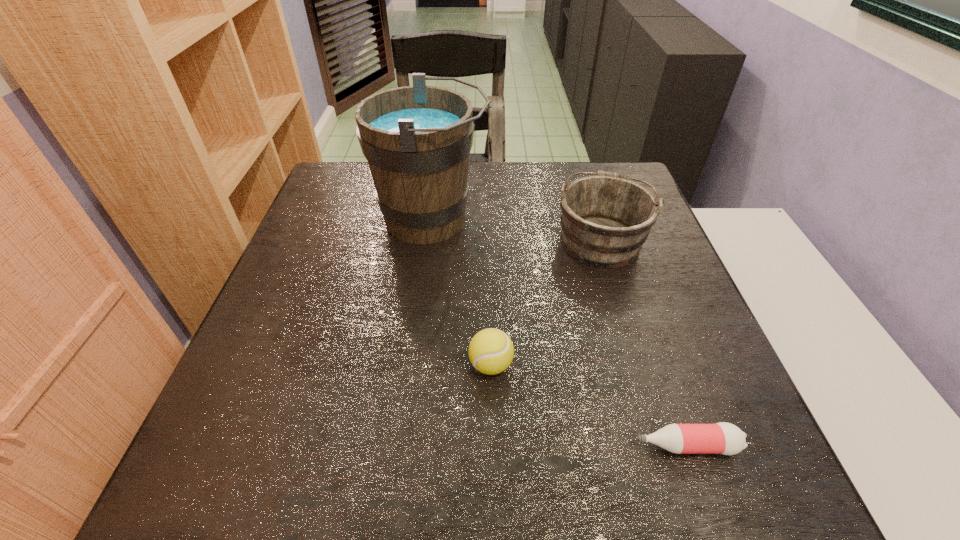
Where is `vacant space located on the left of the second shortest object`? vacant space located on the left of the second shortest object is located at coordinates pyautogui.click(x=286, y=365).

Locate an element on the screen. free space located with the cap open on the shortest object is located at coordinates (467, 446).

At what (x,y) coordinates should I click in order to perform the action: click on free space located 0.210m with the cap open on the shortest object. Please return your answer as a coordinate pair (x, y). Looking at the image, I should click on (504, 446).

Where is `vacant space located with the cap open on the shortest object`? This screenshot has width=960, height=540. vacant space located with the cap open on the shortest object is located at coordinates (404, 446).

At what (x,y) coordinates should I click in order to perform the action: click on object present at the far edge. Please return your answer as a coordinate pair (x, y). The height and width of the screenshot is (540, 960). Looking at the image, I should click on (417, 139).

Locate an element on the screen. object positioned at the near edge is located at coordinates (724, 438).

I want to click on wine bucket located in the right edge section of the desktop, so coord(605,219).

This screenshot has width=960, height=540. In order to click on bottle present at the right edge in this screenshot , I will do `click(724, 438)`.

Image resolution: width=960 pixels, height=540 pixels. What are the coordinates of `object located in the near right corner section of the desktop` in the screenshot? It's located at (724, 438).

In the image, there is a desktop. Where is `vacant area at the far edge`? Image resolution: width=960 pixels, height=540 pixels. vacant area at the far edge is located at coordinates (519, 185).